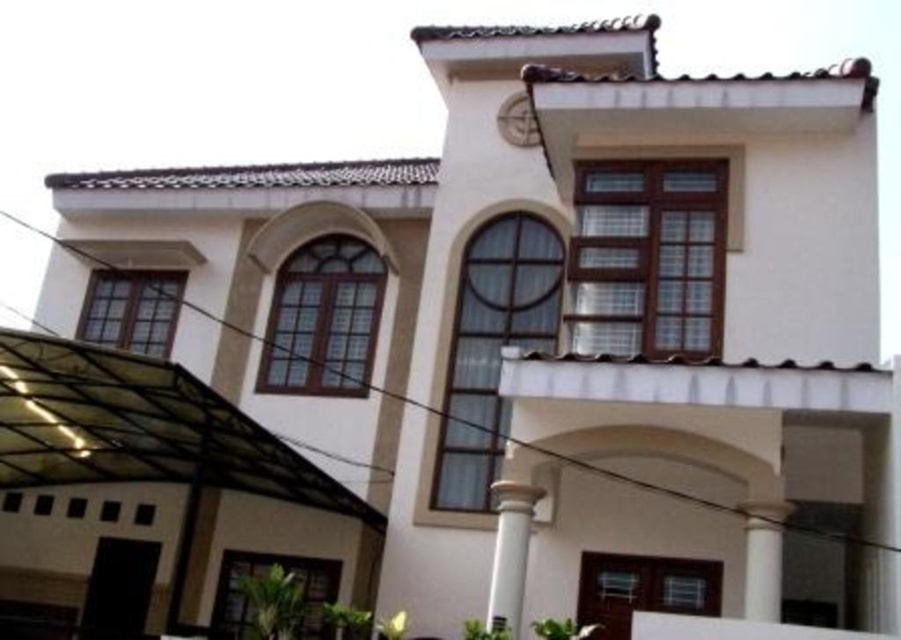
Question: From the image, what is the correct spatial relationship of white smooth column at center in relation to matte white clock at upper center?

Choices:
 (A) below
 (B) above

Answer: (A)

Question: Which object appears farthest from the camera in this image?

Choices:
 (A) matte white clock at upper center
 (B) white smooth column at center

Answer: (A)

Question: Which object appears closest to the camera in this image?

Choices:
 (A) white smooth column at center
 (B) matte white clock at upper center
 (C) white glossy column at center

Answer: (A)

Question: Based on their relative distances, which object is farther from the white glossy column at center?

Choices:
 (A) white smooth column at center
 (B) matte white clock at upper center

Answer: (B)

Question: Can you confirm if white glossy column at center is thinner than matte white clock at upper center?

Choices:
 (A) yes
 (B) no

Answer: (B)

Question: Observing the image, what is the correct spatial positioning of white smooth column at center in reference to matte white clock at upper center?

Choices:
 (A) above
 (B) below

Answer: (B)